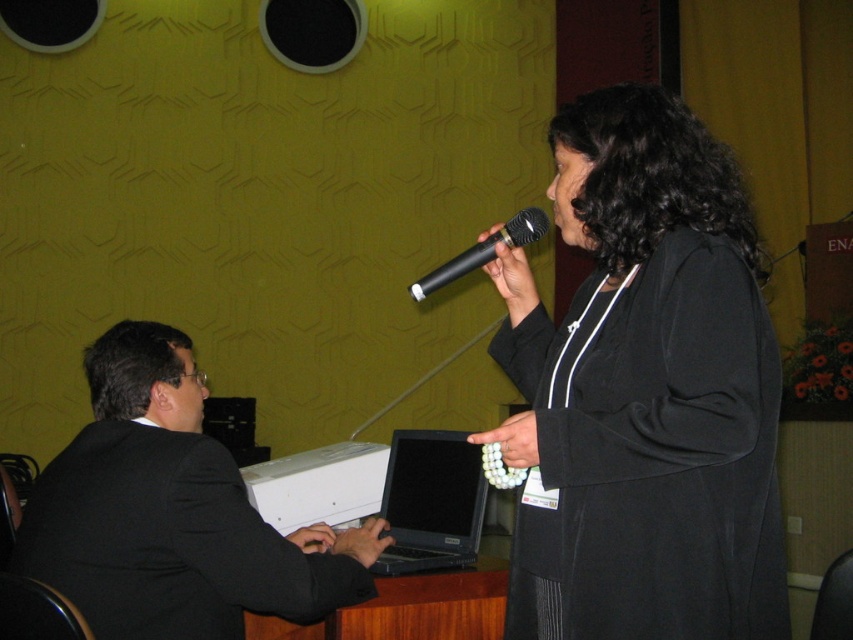
Which is below, black matte laptop at lower center or black matte microphone at upper center?

black matte laptop at lower center is lower down.

Is black matte laptop at lower center closer to the viewer compared to black matte microphone at upper center?

That is False.

Image resolution: width=853 pixels, height=640 pixels. I want to click on black matte laptop at lower center, so click(431, 500).

Does black matte jacket at upper right have a smaller size compared to black matte microphone at upper center?

No, black matte jacket at upper right is not smaller than black matte microphone at upper center.

Measure the distance between black matte jacket at upper right and camera.

black matte jacket at upper right and camera are 1.22 meters apart.

Locate an element on the screen. This screenshot has width=853, height=640. black matte jacket at upper right is located at coordinates (643, 392).

Does black suit at left have a lesser width compared to black matte microphone at upper center?

In fact, black suit at left might be wider than black matte microphone at upper center.

Which is above, black suit at left or black matte microphone at upper center?

black matte microphone at upper center is above.

At what (x,y) coordinates should I click in order to perform the action: click on black suit at left. Please return your answer as a coordinate pair (x, y). The image size is (853, 640). Looking at the image, I should click on (172, 513).